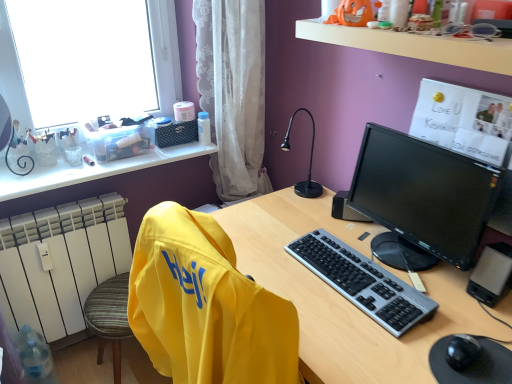
This screenshot has width=512, height=384. I want to click on vacant space in between black plastic keyboard at center and black glossy monitor at center right, so click(x=378, y=260).